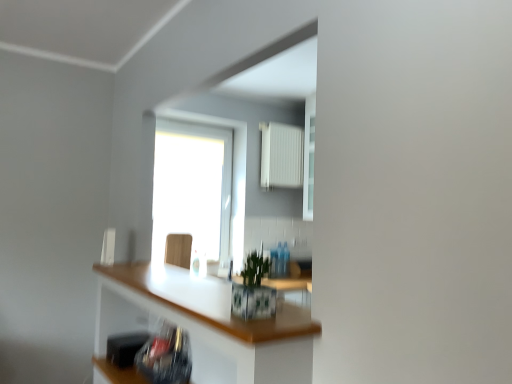
Find the location of a particular element. The width and height of the screenshot is (512, 384). transparent glass window at center is located at coordinates (193, 187).

Identify the location of white glossy countertop at center. (207, 320).

You are a GUI agent. You are given a task and a screenshot of the screen. Output one action in this format:
    pyautogui.click(x=<x>, y=<y>)
    Task: Click on the white plastic radiator at upper center
    Image resolution: width=512 pixels, height=384 pixels.
    Given the screenshot: What is the action you would take?
    pyautogui.click(x=281, y=155)

What is the approximate height of black plastic toaster at lower left?

13.42 centimeters.

This screenshot has height=384, width=512. In order to click on transparent glass window at center in this screenshot , I will do `click(193, 187)`.

Is wooden swivel chair at center spatially inside white plastic radiator at upper center, or outside of it?

wooden swivel chair at center is not enclosed by white plastic radiator at upper center.

Find the location of a particular element. swivel chair that appears in front of the white plastic radiator at upper center is located at coordinates (178, 250).

Looking at this image, based on their positions, is white glossy countertop at center located to the left or right of white plastic radiator at upper center?

Clearly, white glossy countertop at center is on the left of white plastic radiator at upper center in the image.

Looking at this image, is white glossy countertop at center in front of white plastic radiator at upper center?

Yes, the depth of white glossy countertop at center is less than that of white plastic radiator at upper center.

Can you see white glossy countertop at center touching white plastic radiator at upper center?

They are not placed beside each other.

Does white glossy countertop at center appear on the left side of transparent glass window at center?

In fact, white glossy countertop at center is to the right of transparent glass window at center.

Which is behind, point (120, 315) or point (197, 242)?

The point (197, 242) is more distant.

Is transparent glass window at center at the back of white glossy countertop at center?

No, white glossy countertop at center is not facing the opposite direction of transparent glass window at center.

Considering the relative sizes of black plastic toaster at lower left and transparent glass window at center in the image provided, is black plastic toaster at lower left smaller than transparent glass window at center?

Indeed, black plastic toaster at lower left has a smaller size compared to transparent glass window at center.

Which is correct: black plastic toaster at lower left is inside transparent glass window at center, or outside of it?

black plastic toaster at lower left is spatially situated outside transparent glass window at center.

From the image's perspective, between black plastic toaster at lower left and transparent glass window at center, who is located below?

black plastic toaster at lower left.

Is black plastic toaster at lower left taller or shorter than transparent glass window at center?

Considering their sizes, black plastic toaster at lower left has less height than transparent glass window at center.

Does wooden swivel chair at center touch black plastic toaster at lower left?

No, wooden swivel chair at center is not next to black plastic toaster at lower left.

From a real-world perspective, is wooden swivel chair at center positioned above or below black plastic toaster at lower left?

From a real-world perspective, wooden swivel chair at center is physically above black plastic toaster at lower left.

Which is nearer, (179, 241) or (140, 347)?

Clearly, point (179, 241) is more distant from the camera than point (140, 347).

Locate an element on the screen. appliance directly beneath the wooden swivel chair at center (from a real-world perspective) is located at coordinates (125, 347).

Can you confirm if white plastic radiator at upper center is thinner than black plastic toaster at lower left?

Yes, white plastic radiator at upper center is thinner than black plastic toaster at lower left.

Can you confirm if white plastic radiator at upper center is bigger than black plastic toaster at lower left?

Yes.

From a real-world perspective, which object rests below the other?

black plastic toaster at lower left.

Does white plastic radiator at upper center have a lesser height compared to black plastic toaster at lower left?

Incorrect, the height of white plastic radiator at upper center does not fall short of that of black plastic toaster at lower left.

Identify the location of radiator above the white glossy countertop at center (from the image's perspective). The image size is (512, 384). coord(281,155).

Does white plastic radiator at upper center touch white glossy countertop at center?

No, white plastic radiator at upper center is not with white glossy countertop at center.

Is white plastic radiator at upper center behind white glossy countertop at center?

Yes, white plastic radiator at upper center is further from the viewer.

Identify the location of radiator lying behind the wooden swivel chair at center. This screenshot has height=384, width=512. (281, 155).

You are a GUI agent. You are given a task and a screenshot of the screen. Output one action in this format:
    pyautogui.click(x=<x>, y=<y>)
    Task: Click on the countertop below the white plastic radiator at upper center (from a real-world perspective)
    The height and width of the screenshot is (384, 512).
    Given the screenshot: What is the action you would take?
    pyautogui.click(x=207, y=320)

From the image, which object appears to be farther from white glossy countertop at center, black plastic toaster at lower left or transparent glass window at center?

transparent glass window at center lies further to white glossy countertop at center than the other object.

Based on their spatial positions, is white glossy countertop at center or black plastic toaster at lower left closer to transparent glass window at center?

white glossy countertop at center is closer to transparent glass window at center.

From the picture: Considering their positions, is transparent glass window at center positioned closer to white plastic radiator at upper center than white glossy countertop at center?

Based on the image, transparent glass window at center appears to be nearer to white plastic radiator at upper center.

Based on their spatial positions, is wooden swivel chair at center or white plastic radiator at upper center further from white glossy countertop at center?

Based on the image, white plastic radiator at upper center appears to be further to white glossy countertop at center.

Considering their positions, is black plastic toaster at lower left positioned further to white glossy countertop at center than wooden swivel chair at center?

wooden swivel chair at center is positioned further to the anchor white glossy countertop at center.

Considering their positions, is white glossy countertop at center positioned closer to wooden swivel chair at center than black plastic toaster at lower left?

black plastic toaster at lower left is closer to wooden swivel chair at center.

Based on their spatial positions, is wooden swivel chair at center or transparent glass window at center closer to black plastic toaster at lower left?

wooden swivel chair at center.

Estimate the real-world distances between objects in this image. Which object is further from white plastic radiator at upper center, wooden swivel chair at center or black plastic toaster at lower left?

black plastic toaster at lower left is positioned further to the anchor white plastic radiator at upper center.

Where is `appliance positioned between white glossy countertop at center and wooden swivel chair at center from near to far`? This screenshot has height=384, width=512. appliance positioned between white glossy countertop at center and wooden swivel chair at center from near to far is located at coordinates (125, 347).

I want to click on swivel chair between white glossy countertop at center and white plastic radiator at upper center along the z-axis, so click(x=178, y=250).

Where is `window between white glossy countertop at center and white plastic radiator at upper center in the front-back direction`? The image size is (512, 384). window between white glossy countertop at center and white plastic radiator at upper center in the front-back direction is located at coordinates 193,187.

Identify the location of swivel chair between transparent glass window at center and white plastic radiator at upper center from left to right. This screenshot has width=512, height=384. (178, 250).